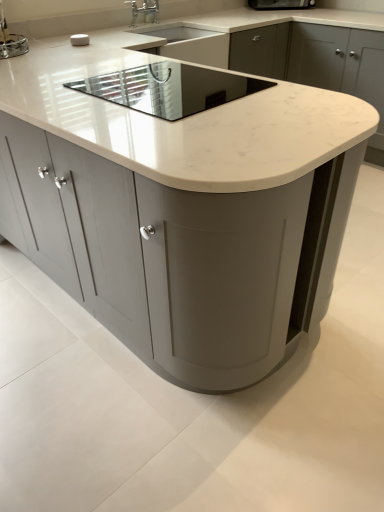
How much space does black glass cooktop at center, which is counted as the second appliance, starting from the top, occupy horizontally?

20.62 inches.

Describe the element at coordinates (169, 88) in the screenshot. I see `black glass cooktop at center, arranged as the second appliance when viewed from the left` at that location.

In order to face white marble countertop at center, should I rotate leftwards or rightwards?

You should rotate right by 8.882 degrees.

At what (x,y) coordinates should I click in order to perform the action: click on satin nickel faucet at upper center. Please return your answer as a coordinate pair (x, y). Looking at the image, I should click on (150, 11).

Locate an element on the screen. black glass cooktop at center, arranged as the 1th appliance when viewed from the right is located at coordinates (169, 88).

Does white marble countertop at center touch black glass cooktop at center, arranged as the second appliance when viewed from the left?

No.

Looking at this image, considering the sizes of objects white marble countertop at center and black glass cooktop at center, the first appliance positioned from the bottom, in the image provided, who is taller, white marble countertop at center or black glass cooktop at center, the first appliance positioned from the bottom,?

Standing taller between the two is white marble countertop at center.

Can you confirm if white marble countertop at center is smaller than black glass cooktop at center, the 1th appliance in the front-to-back sequence?

No, white marble countertop at center is not smaller than black glass cooktop at center, the 1th appliance in the front-to-back sequence.

Is white marble countertop at center inside the boundaries of black glass cooktop at center, arranged as the 1th appliance when viewed from the right, or outside?

white marble countertop at center is spatially situated outside black glass cooktop at center, arranged as the 1th appliance when viewed from the right.

From a real-world perspective, who is located higher, metallic silver toaster at upper left, the first appliance viewed from the left, or black glass cooktop at center, arranged as the second appliance when viewed from the left?

In real-world perspective, metallic silver toaster at upper left, the first appliance viewed from the left, is above.

Based on the photo, is metallic silver toaster at upper left, arranged as the 2th appliance when viewed from the front, with black glass cooktop at center, arranged as the 1th appliance when viewed from the right?

No, metallic silver toaster at upper left, arranged as the 2th appliance when viewed from the front, is not with black glass cooktop at center, arranged as the 1th appliance when viewed from the right.

Is point (1, 47) positioned after point (139, 80)?

Yes, it is.

Between metallic silver toaster at upper left, positioned as the 1th appliance in back-to-front order, and black glass cooktop at center, the 1th appliance in the front-to-back sequence, which one is positioned in front?

black glass cooktop at center, the 1th appliance in the front-to-back sequence.

From the image's perspective, is metallic silver toaster at upper left, arranged as the 2th appliance when viewed from the front, positioned above or below chrome metallic faucet at upper center?

metallic silver toaster at upper left, arranged as the 2th appliance when viewed from the front, is below chrome metallic faucet at upper center.

Is metallic silver toaster at upper left, arranged as the 2th appliance when viewed from the front, not near chrome metallic faucet at upper center?

No, metallic silver toaster at upper left, arranged as the 2th appliance when viewed from the front, is in close proximity to chrome metallic faucet at upper center.

Where is `tap that is behind the metallic silver toaster at upper left, positioned as the 1th appliance in back-to-front order`? tap that is behind the metallic silver toaster at upper left, positioned as the 1th appliance in back-to-front order is located at coordinates (144, 11).

Considering the sizes of black glass cooktop at center, arranged as the second appliance when viewed from the left, and metallic silver toaster at upper left, arranged as the 2th appliance when viewed from the front, in the image, is black glass cooktop at center, arranged as the second appliance when viewed from the left, taller or shorter than metallic silver toaster at upper left, arranged as the 2th appliance when viewed from the front,?

In the image, black glass cooktop at center, arranged as the second appliance when viewed from the left, appears to be shorter than metallic silver toaster at upper left, arranged as the 2th appliance when viewed from the front.

Does black glass cooktop at center, which is counted as the second appliance, starting from the top, come in front of metallic silver toaster at upper left, marked as the 1th appliance in a top-to-bottom arrangement?

That is True.

In the scene shown: Is black glass cooktop at center, the 1th appliance in the front-to-back sequence, in contact with metallic silver toaster at upper left, the first appliance viewed from the left?

No, black glass cooktop at center, the 1th appliance in the front-to-back sequence, is not in contact with metallic silver toaster at upper left, the first appliance viewed from the left.

Could you measure the distance between black glass cooktop at center, arranged as the 1th appliance when viewed from the right, and metallic silver toaster at upper left, marked as the 1th appliance in a top-to-bottom arrangement?

They are 35.46 inches apart.

Between white marble countertop at center and white marble countertop at center, which one is positioned in front?

white marble countertop at center is in front.

From a real-world perspective, between white marble countertop at center and white marble countertop at center, who is vertically higher?

From a 3D spatial view, white marble countertop at center is above.

Is white marble countertop at center turned away from white marble countertop at center?

That's not correct — white marble countertop at center is not looking away from white marble countertop at center.

From the image's perspective, would you say white marble countertop at center is shown under white marble countertop at center?

Incorrect, from the image's perspective, white marble countertop at center is higher than white marble countertop at center.

From a real-world perspective, does chrome metallic faucet at upper center sit lower than white marble countertop at center?

No, from a real-world perspective, chrome metallic faucet at upper center is not under white marble countertop at center.

Is white marble countertop at center located within chrome metallic faucet at upper center?

Actually, white marble countertop at center is outside chrome metallic faucet at upper center.

Consider the image. Can you confirm if chrome metallic faucet at upper center is bigger than white marble countertop at center?

Incorrect, chrome metallic faucet at upper center is not larger than white marble countertop at center.

From the image's perspective, is chrome metallic faucet at upper center positioned above or below white marble countertop at center?

Clearly, from the image's perspective, chrome metallic faucet at upper center is above white marble countertop at center.

In the image, is black glass cooktop at center, the 1th appliance in the front-to-back sequence, on the left side or the right side of satin nickel faucet at upper center?

From the image, it's evident that black glass cooktop at center, the 1th appliance in the front-to-back sequence, is to the right of satin nickel faucet at upper center.

Where is `faucet that is above the black glass cooktop at center, arranged as the 1th appliance when viewed from the right (from a real-world perspective)`? This screenshot has width=384, height=512. faucet that is above the black glass cooktop at center, arranged as the 1th appliance when viewed from the right (from a real-world perspective) is located at coordinates (150, 11).

Consider the image. Is black glass cooktop at center, arranged as the 1th appliance when viewed from the right, positioned far away from satin nickel faucet at upper center?

Yes, black glass cooktop at center, arranged as the 1th appliance when viewed from the right, and satin nickel faucet at upper center are quite far apart.

Which appliance is the 1st one when counting from the left side of the white marble countertop at center? Please provide its 2D coordinates.

[(169, 88)]

Locate an element on the screen. The width and height of the screenshot is (384, 512). appliance above the black glass cooktop at center, acting as the second appliance starting from the back (from a real-world perspective) is located at coordinates click(13, 46).

Consider the image. Estimate the real-world distances between objects in this image. Which object is further from black glass cooktop at center, which is counted as the second appliance, starting from the top, white marble countertop at center or satin nickel faucet at upper center?

Based on the image, satin nickel faucet at upper center appears to be further to black glass cooktop at center, which is counted as the second appliance, starting from the top.

Looking at the image, which one is located further to white marble countertop at center, chrome metallic faucet at upper center or satin nickel faucet at upper center?

The object further to white marble countertop at center is satin nickel faucet at upper center.

From the picture: Estimate the real-world distances between objects in this image. Which object is further from chrome metallic faucet at upper center, metallic silver toaster at upper left, positioned as the 1th appliance in back-to-front order, or black glass cooktop at center, arranged as the second appliance when viewed from the left?

Among the two, black glass cooktop at center, arranged as the second appliance when viewed from the left, is located further to chrome metallic faucet at upper center.

From the picture: From the image, which object appears to be nearer to black glass cooktop at center, which is counted as the second appliance, starting from the top, white marble countertop at center or white marble countertop at center?

white marble countertop at center is closer to black glass cooktop at center, which is counted as the second appliance, starting from the top.

Based on their spatial positions, is white marble countertop at center or black glass cooktop at center, arranged as the 1th appliance when viewed from the right, further from chrome metallic faucet at upper center?

black glass cooktop at center, arranged as the 1th appliance when viewed from the right.

From the image, which object appears to be farther from satin nickel faucet at upper center, white marble countertop at center or black glass cooktop at center, arranged as the second appliance when viewed from the left?

Among the two, black glass cooktop at center, arranged as the second appliance when viewed from the left, is located further to satin nickel faucet at upper center.

Which object lies nearer to the anchor point black glass cooktop at center, arranged as the second appliance when viewed from the left, white marble countertop at center or white marble countertop at center?

The object closer to black glass cooktop at center, arranged as the second appliance when viewed from the left, is white marble countertop at center.

Based on their spatial positions, is white marble countertop at center or black glass cooktop at center, acting as the second appliance starting from the back, closer to white marble countertop at center?

Among the two, black glass cooktop at center, acting as the second appliance starting from the back, is located nearer to white marble countertop at center.

This screenshot has width=384, height=512. What are the coordinates of `appliance between chrome metallic faucet at upper center and white marble countertop at center in the horizontal direction` in the screenshot? It's located at (169, 88).

Locate an element on the screen. tap located between white marble countertop at center and satin nickel faucet at upper center in the depth direction is located at coordinates (144, 11).

Find the location of `cabinetry between black glass cooktop at center, acting as the second appliance starting from the back, and satin nickel faucet at upper center in the front-back direction`. cabinetry between black glass cooktop at center, acting as the second appliance starting from the back, and satin nickel faucet at upper center in the front-back direction is located at coordinates (318, 63).

Find the location of a particular element. The image size is (384, 512). tap between metallic silver toaster at upper left, the first appliance viewed from the left, and satin nickel faucet at upper center in the front-back direction is located at coordinates (144, 11).